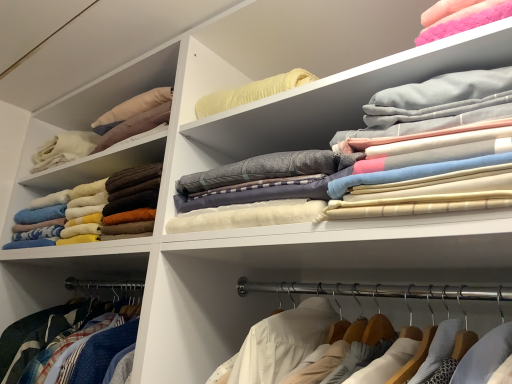
Question: From the image's perspective, is fluffy brown blanket at left, which ranks as the 1th clothing in left-to-right order, located above or below soft cotton sheets at upper right, which ranks as the second clothing in left-to-right order?

Choices:
 (A) below
 (B) above

Answer: (A)

Question: From a real-world perspective, is fluffy brown blanket at left, the 2th clothing positioned from the right, above or below soft cotton sheets at upper right, which ranks as the second clothing in left-to-right order?

Choices:
 (A) below
 (B) above

Answer: (A)

Question: Considering the positions of fluffy brown blanket at left, the 2th clothing positioned from the right, and soft cotton sheets at upper right, which ranks as the second clothing in left-to-right order, in the image, is fluffy brown blanket at left, the 2th clothing positioned from the right, wider or thinner than soft cotton sheets at upper right, which ranks as the second clothing in left-to-right order,?

Choices:
 (A) wide
 (B) thin

Answer: (A)

Question: Looking at their shapes, would you say soft cotton sheets at upper right, which ranks as the second clothing in left-to-right order, is wider or thinner than fluffy brown blanket at left, the 1th clothing viewed from the back?

Choices:
 (A) wide
 (B) thin

Answer: (B)

Question: From the image's perspective, is soft cotton sheets at upper right, which is the first clothing in front-to-back order, positioned above or below fluffy brown blanket at left, the 2th clothing positioned from the right?

Choices:
 (A) below
 (B) above

Answer: (B)

Question: Considering their positions, is soft cotton sheets at upper right, the 2th clothing viewed from the back, located in front of or behind fluffy brown blanket at left, which ranks as the 1th clothing in left-to-right order?

Choices:
 (A) front
 (B) behind

Answer: (A)

Question: Which is correct: soft cotton sheets at upper right, which ranks as the second clothing in left-to-right order, is inside fluffy brown blanket at left, the 2th clothing in the front-to-back sequence, or outside of it?

Choices:
 (A) outside
 (B) inside

Answer: (A)